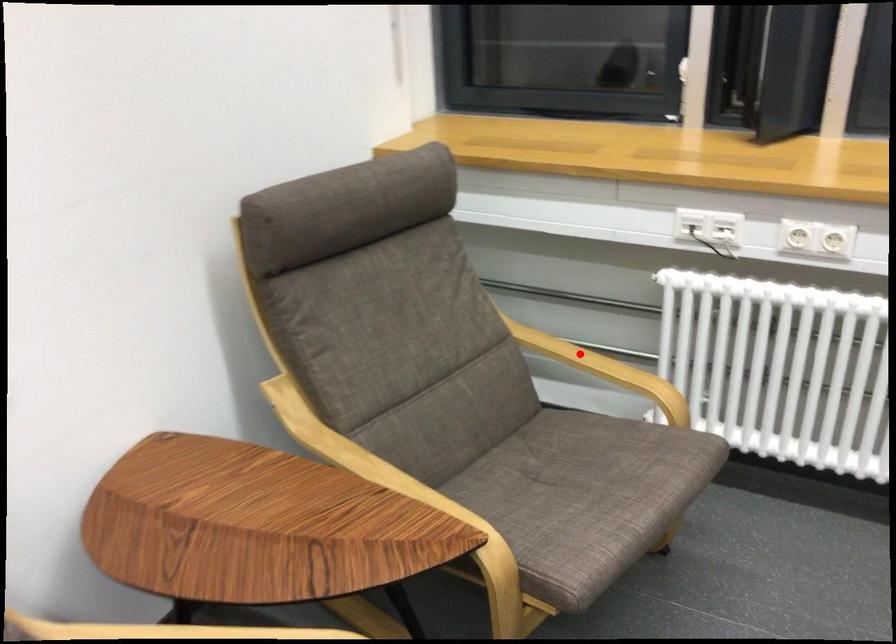
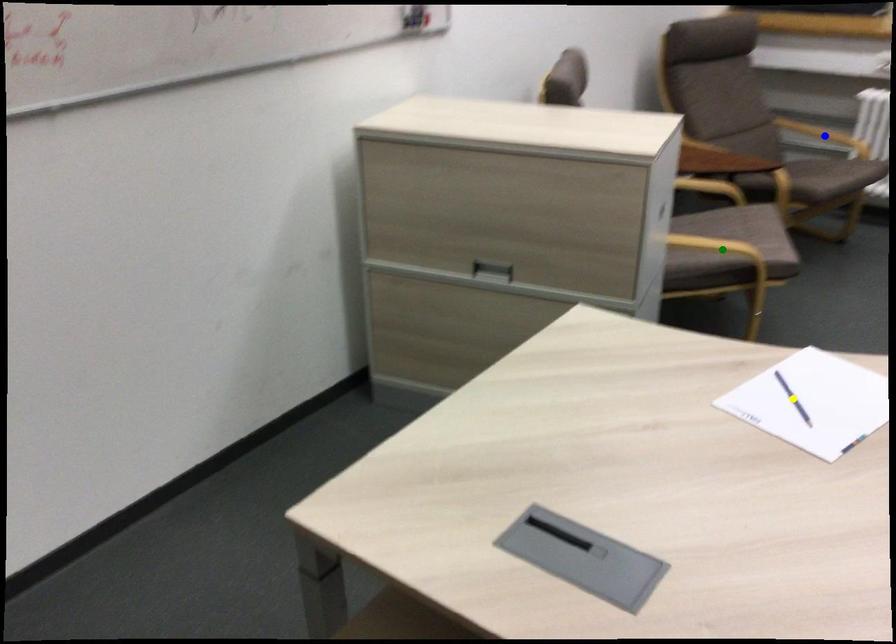
Question: I am providing you with two images of the same scene from different viewpoints. A red point is marked on the first image. You are given multiple points on the second image. In image 2, which mark is for the same physical point as the one in image 1?

Choices:
 (A) yellow point
 (B) green point
 (C) blue point

Answer: (C)